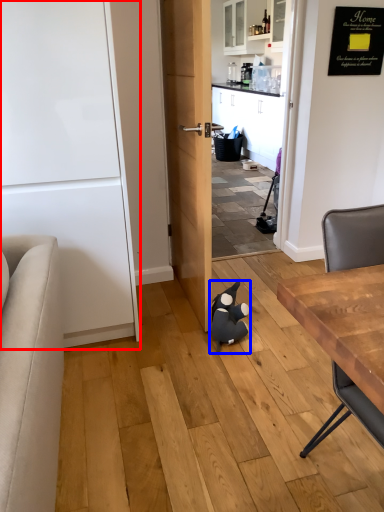
Question: Which object is closer to the camera taking this photo, door (highlighted by a red box) or animal (highlighted by a blue box)?

Choices:
 (A) door
 (B) animal

Answer: (A)